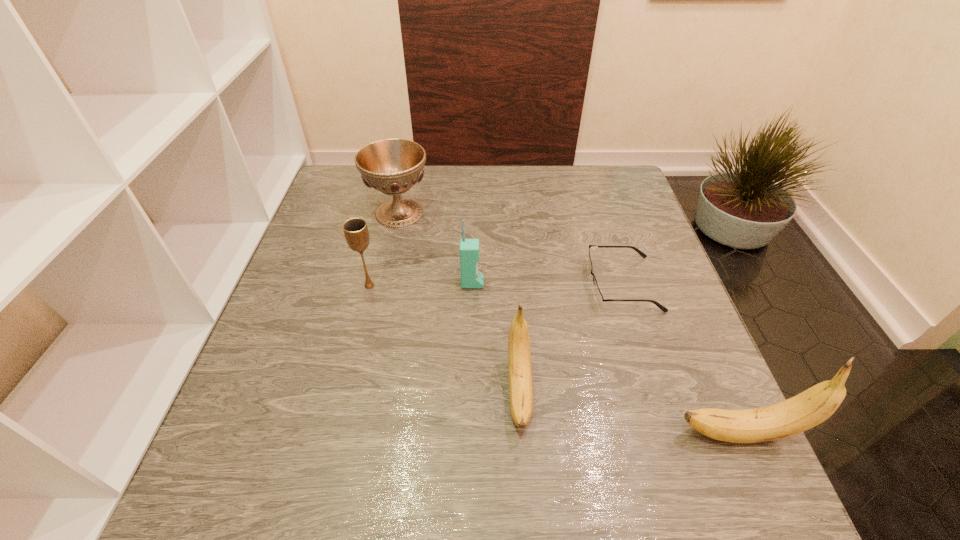
Identify the location of vacant region between the farthest object and the spectacles. (511, 248).

At what (x,y) coordinates should I click in order to perform the action: click on free spot between the farther chalice and the left banana. Please return your answer as a coordinate pair (x, y). The height and width of the screenshot is (540, 960). Looking at the image, I should click on (460, 302).

Find the location of a particular element. free space that is in between the nearer chalice and the shortest object is located at coordinates (495, 285).

The width and height of the screenshot is (960, 540). I want to click on vacant space that is in between the taller banana and the farthest object, so click(570, 323).

At what (x,y) coordinates should I click in order to perform the action: click on empty space between the shortest object and the farthest object. Please return your answer as a coordinate pair (x, y). Looking at the image, I should click on (511, 248).

Where is `vacant region between the farther chalice and the left banana`? vacant region between the farther chalice and the left banana is located at coordinates (x=460, y=302).

Where is `vacant point located between the shorter banana and the taller banana`? This screenshot has height=540, width=960. vacant point located between the shorter banana and the taller banana is located at coordinates (630, 413).

Find the location of `free space between the tallest object and the third object from left to right`. free space between the tallest object and the third object from left to right is located at coordinates (607, 359).

Where is `unoccupied area between the taller banana and the farther chalice`? The height and width of the screenshot is (540, 960). unoccupied area between the taller banana and the farther chalice is located at coordinates (570, 323).

The image size is (960, 540). Identify the location of object that is the closest to the taller banana. (519, 352).